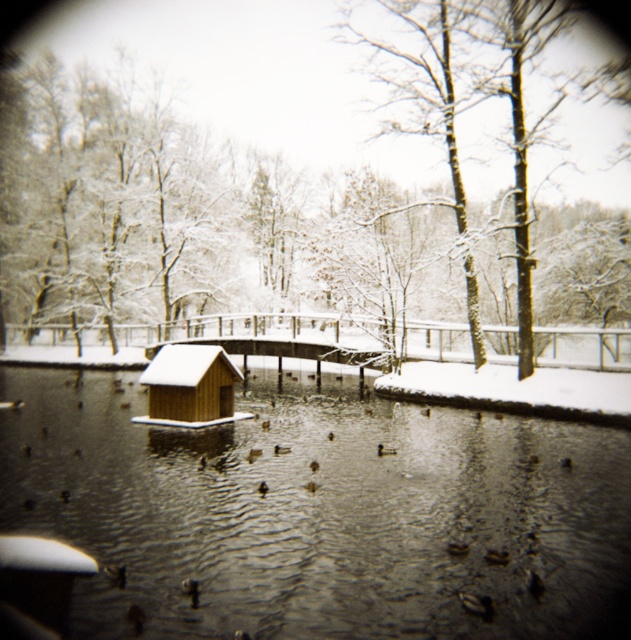
Question: Which object appears farthest from the camera in this image?

Choices:
 (A) brown matte duck at center
 (B) snow-covered tree at center
 (C) smooth water at center
 (D) wooden hut at center

Answer: (B)

Question: Which object is positioned farthest from the wooden hut at center?

Choices:
 (A) brown matte duck at center
 (B) smooth water at center
 (C) snow-covered tree at center

Answer: (C)

Question: Which object is farther from the camera taking this photo?

Choices:
 (A) snow-covered tree at center
 (B) wooden hut at center
 (C) smooth water at center
 (D) brown matte duck at center

Answer: (A)

Question: Can you confirm if wooden hut at center is positioned above brown matte duck at center?

Choices:
 (A) yes
 (B) no

Answer: (A)

Question: Is the position of wooden hut at center more distant than that of snow-covered tree at center?

Choices:
 (A) no
 (B) yes

Answer: (A)

Question: Is smooth water at center wider than brown matte duck at center?

Choices:
 (A) no
 (B) yes

Answer: (B)